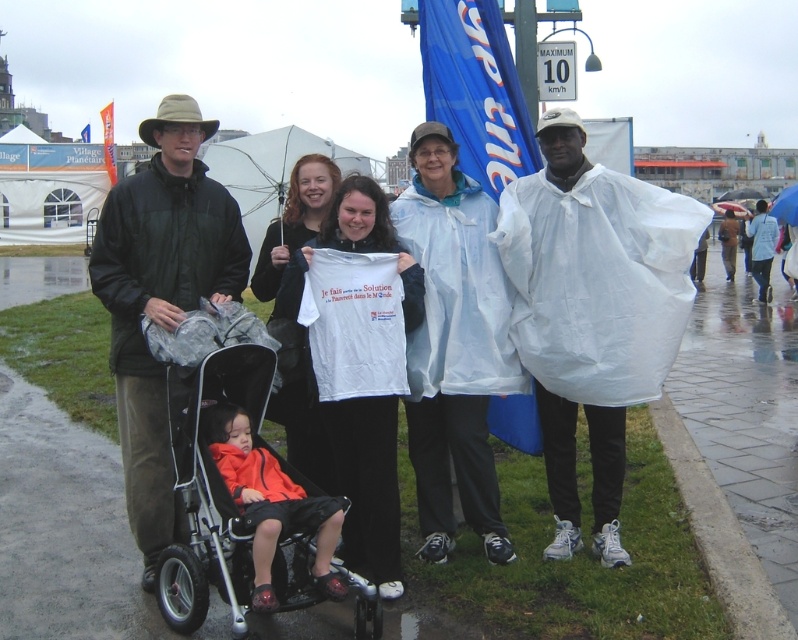
Question: Which object is positioned farthest from the black plastic stroller at lower left?

Choices:
 (A) white plastic poncho at center
 (B) transparent plastic umbrella at upper center
 (C) orange fabric jacket at center
 (D) white matte t-shirt at center

Answer: (B)

Question: Is black plastic stroller at lower left further to the viewer compared to orange fabric jacket at center?

Choices:
 (A) yes
 (B) no

Answer: (A)

Question: Which point is farther from the camera taking this photo?

Choices:
 (A) (322, 504)
 (B) (793, 193)
 (C) (334, 173)

Answer: (B)

Question: Does white plastic poncho at center have a lesser width compared to white matte t-shirt at center?

Choices:
 (A) no
 (B) yes

Answer: (A)

Question: Does white matte t-shirt at center have a lesser width compared to transparent plastic umbrella at upper center?

Choices:
 (A) yes
 (B) no

Answer: (A)

Question: Among these points, which one is nearest to the camera?

Choices:
 (A) coord(350,513)
 (B) coord(251,595)
 (C) coord(228,541)

Answer: (B)